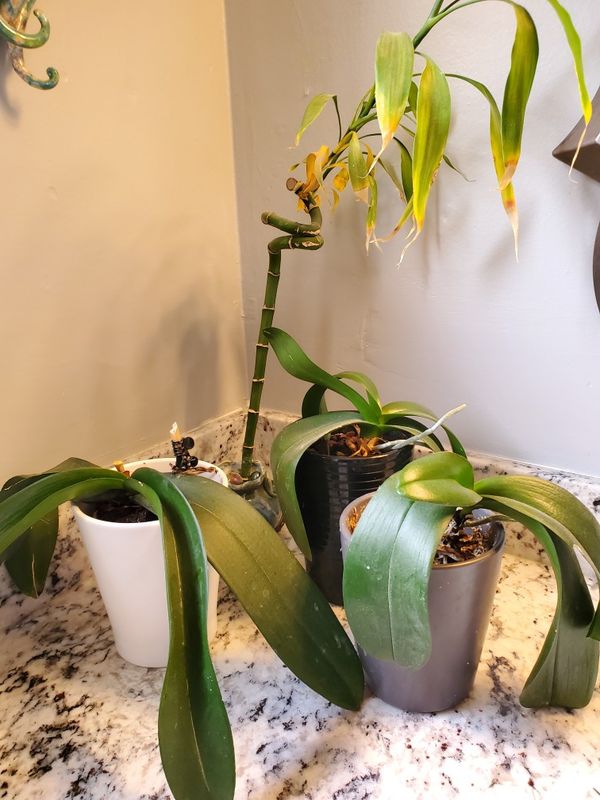
Locate an element on the screen. The height and width of the screenshot is (800, 600). wall is located at coordinates (164, 130), (500, 302).